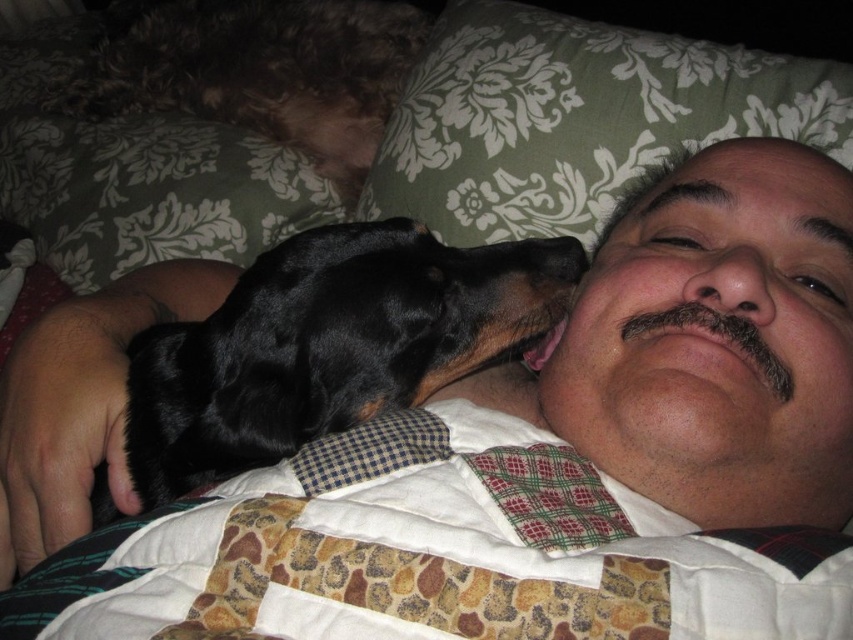
You are a pet sitter who needs to place the black fur dog at center and the fuzzy brown dog at upper left into a dog carrier. The carrier has a height limit of 30 cm. Can both dogs fit vertically in the carrier if they stand on their hind legs?

The black fur dog at center is not as tall as the fuzzy brown dog at upper left. If the fuzzy brown dog at upper left is under 30 cm in height, then both can fit. However, if the fuzzy brown dog at upper left exceeds 30 cm, only the black fur dog at center would fit.

In the scene described, where is the black fur dog at center relative to the fuzzy brown dog at upper left?

The black fur dog at center is to the right of the fuzzy brown dog at upper left.